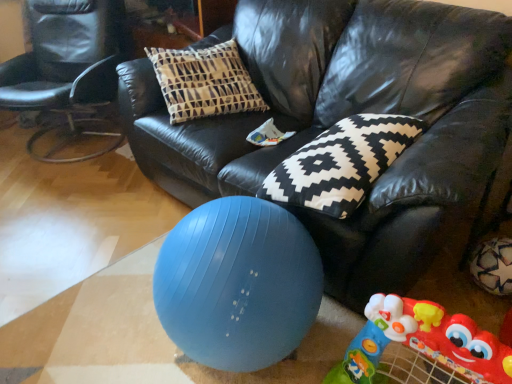
The image size is (512, 384). Identify the location of free space in front of black leather chair at left. (60, 194).